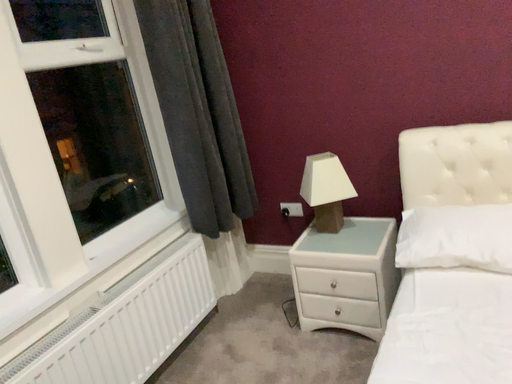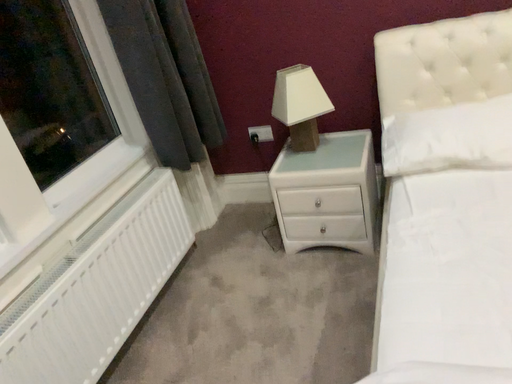
Question: How did the camera likely rotate when shooting the video?

Choices:
 (A) rotated downward
 (B) rotated upward

Answer: (A)